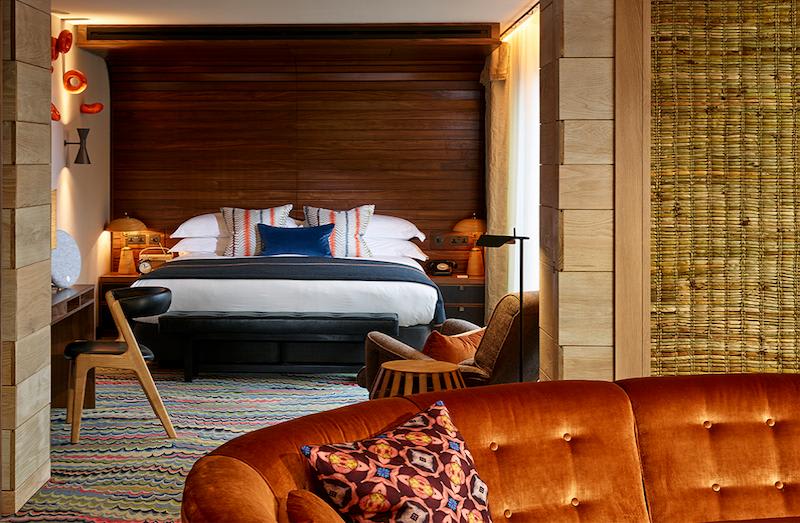
Where is `rug`? rug is located at coordinates (96, 439).